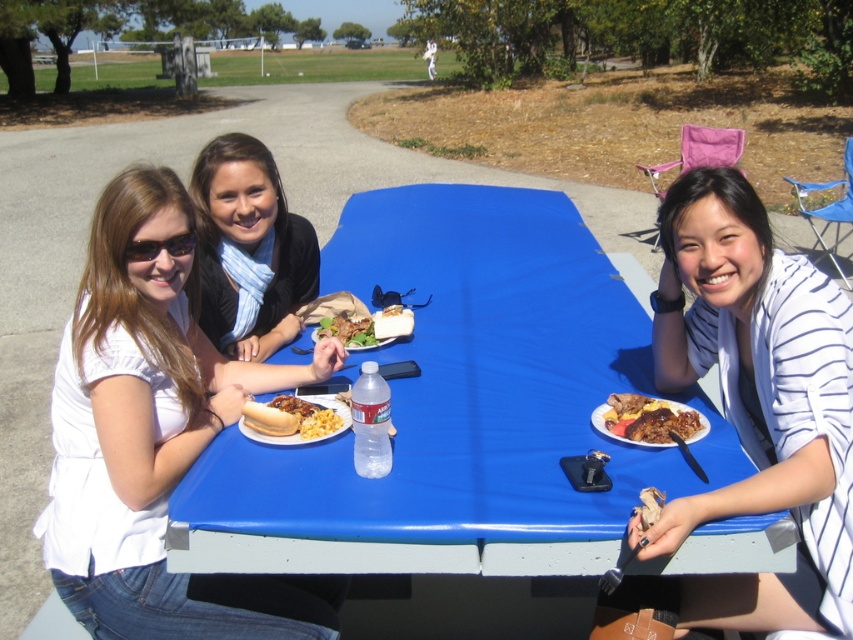
Is blue plastic table at center to the left of blue striped scarf at center from the viewer's perspective?

Incorrect, blue plastic table at center is not on the left side of blue striped scarf at center.

Does blue plastic table at center appear on the right side of blue striped scarf at center?

Yes, blue plastic table at center is to the right of blue striped scarf at center.

What are the coordinates of `blue plastic table at center` in the screenshot? It's located at (459, 406).

Can you confirm if white striped shirt at upper right is positioned above golden crispy hot dog bun at center?

Correct, white striped shirt at upper right is located above golden crispy hot dog bun at center.

Which is above, white striped shirt at upper right or golden crispy hot dog bun at center?

white striped shirt at upper right is above.

Is point (788, 417) closer to camera compared to point (291, 428)?

Yes, it is.

Find the location of a particular element. The height and width of the screenshot is (640, 853). white striped shirt at upper right is located at coordinates (758, 401).

Between point (54, 586) and point (619, 416), which one is positioned in front?

Point (619, 416) is more forward.

Between white matte shirt at left and brown glossy meat at right, which one has more height?

Standing taller between the two is white matte shirt at left.

The width and height of the screenshot is (853, 640). What do you see at coordinates (154, 435) in the screenshot?
I see `white matte shirt at left` at bounding box center [154, 435].

Locate an element on the screen. white matte shirt at left is located at coordinates (154, 435).